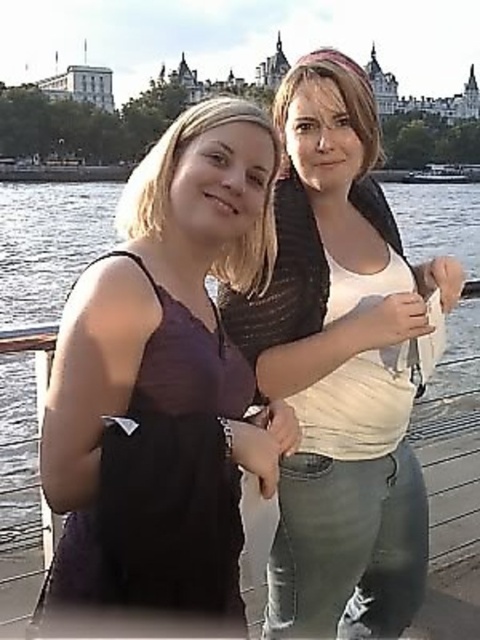
Question: Is purple matte tank top at left above white matte shirt at center?

Choices:
 (A) yes
 (B) no

Answer: (B)

Question: Can you confirm if purple matte tank top at left is positioned to the right of white matte shirt at center?

Choices:
 (A) no
 (B) yes

Answer: (A)

Question: Among these points, which one is nearest to the camera?

Choices:
 (A) (251, 145)
 (B) (283, 134)

Answer: (A)

Question: Is purple matte tank top at left positioned at the back of white matte shirt at center?

Choices:
 (A) yes
 (B) no

Answer: (B)